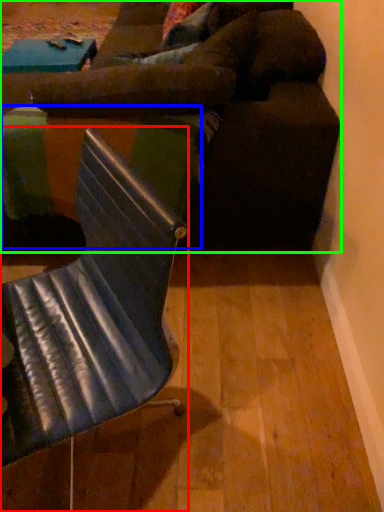
Question: Which object is the closest to the chair (highlighted by a red box)? Choose among these: table (highlighted by a blue box) or studio couch (highlighted by a green box).

Choices:
 (A) table
 (B) studio couch

Answer: (A)